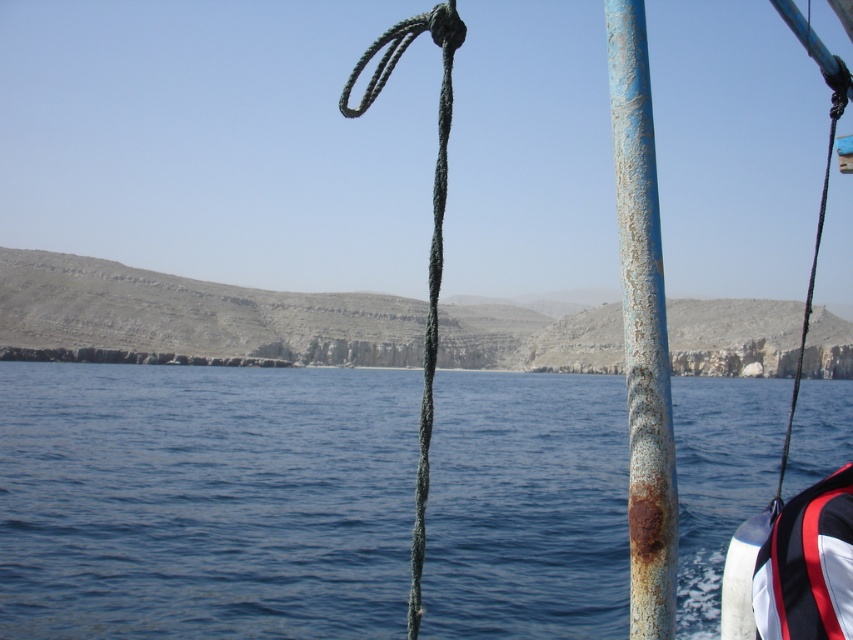
You are a sailor on the deck of a boat trying to secure equipment. You have two green ropes available on the deck. The green rough rope at center is tied to a pole, and the green rope at right is hanging loosely. If you need to secure an object that is 500 feet away from the boat, which rope should you use?

The distance between the green rough rope at center and the green rope at right is 409.98 feet. Since the object is 500 feet away, neither of the ropes would be long enough to reach it. You need a longer rope.